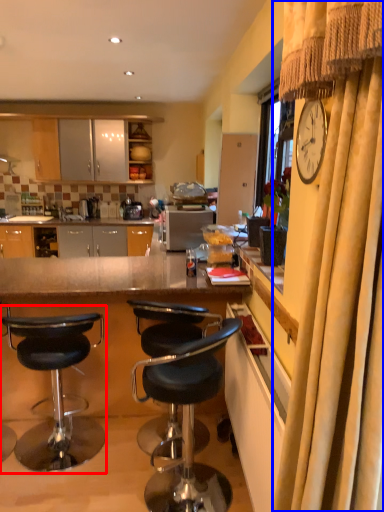
Question: Which object is closer to the camera taking this photo, chair (highlighted by a red box) or curtain (highlighted by a blue box)?

Choices:
 (A) chair
 (B) curtain

Answer: (B)